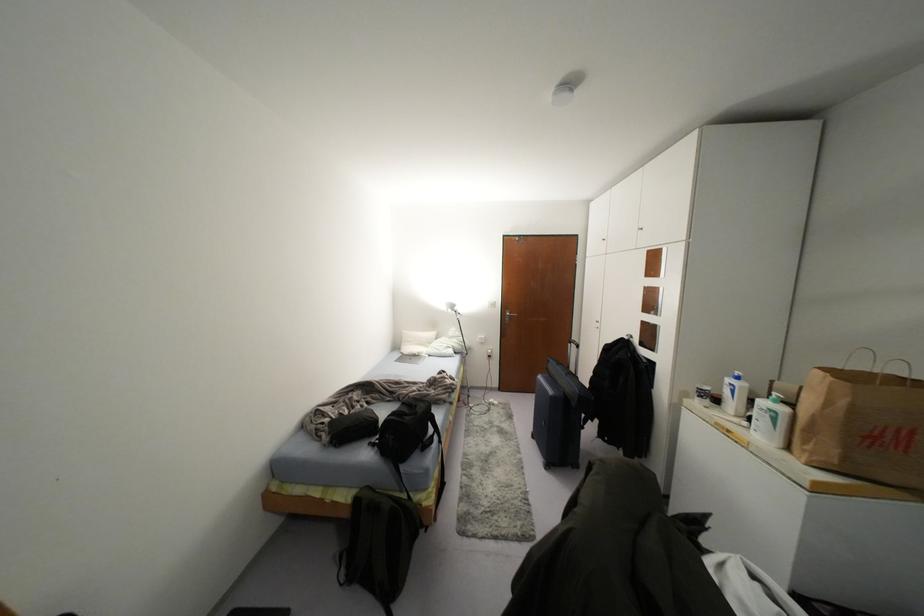
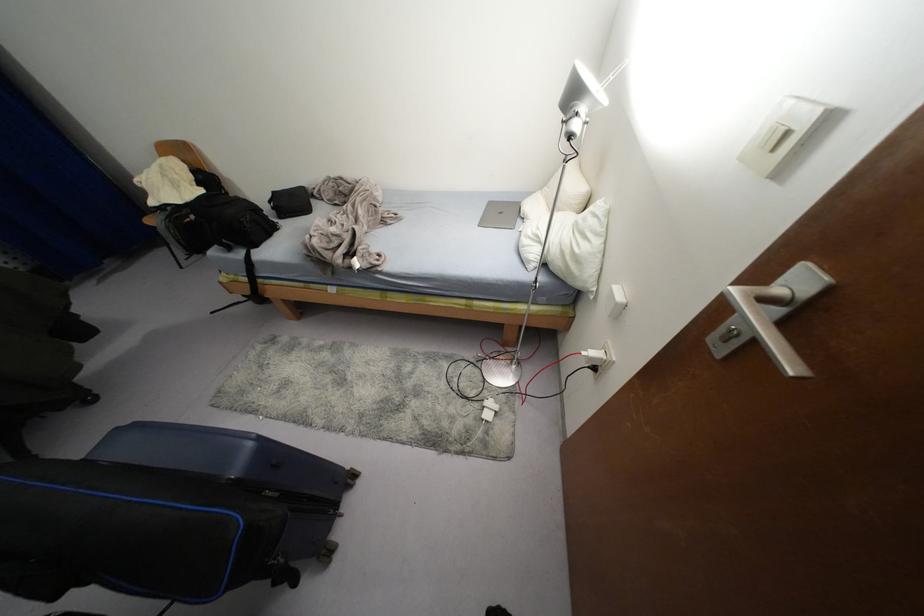
Locate, in the second image, the point that corresponds to pixel 494 402 in the first image.

(487, 416)